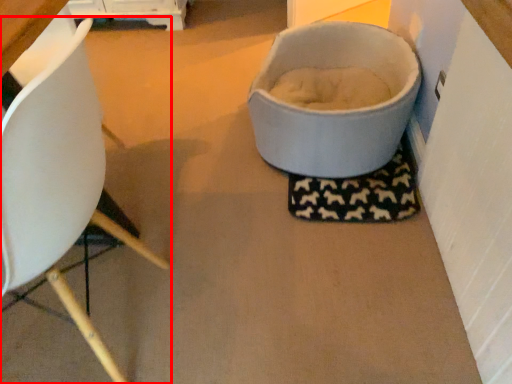
Question: Where is chair (annotated by the red box) located in relation to toilet bowl in the image?

Choices:
 (A) right
 (B) left

Answer: (B)